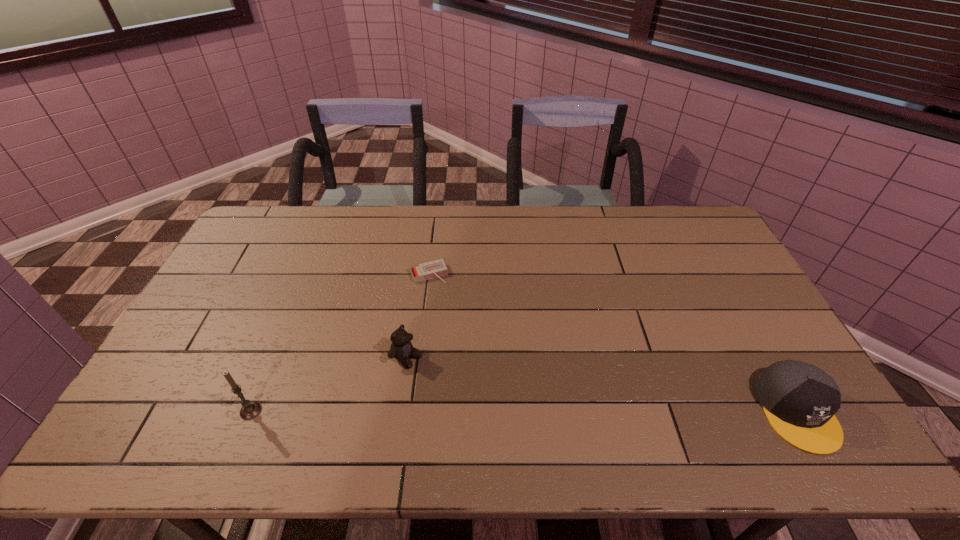
Identify the location of vacant space that's between the leftmost object and the matchbox. (340, 342).

This screenshot has height=540, width=960. I want to click on free space between the shortest object and the cap, so click(612, 342).

Find the location of a particular element. The image size is (960, 540). object that is the second nearest to the cap is located at coordinates (436, 268).

At what (x,y) coordinates should I click in order to perform the action: click on object that stands as the closest to the leftmost object. Please return your answer as a coordinate pair (x, y). Looking at the image, I should click on (401, 348).

This screenshot has height=540, width=960. Find the location of `vacant region that satisfies the following two spatial constraints: 1. on the back side of the teddy bear; 2. on the right side of the matchbox`. vacant region that satisfies the following two spatial constraints: 1. on the back side of the teddy bear; 2. on the right side of the matchbox is located at coordinates (419, 273).